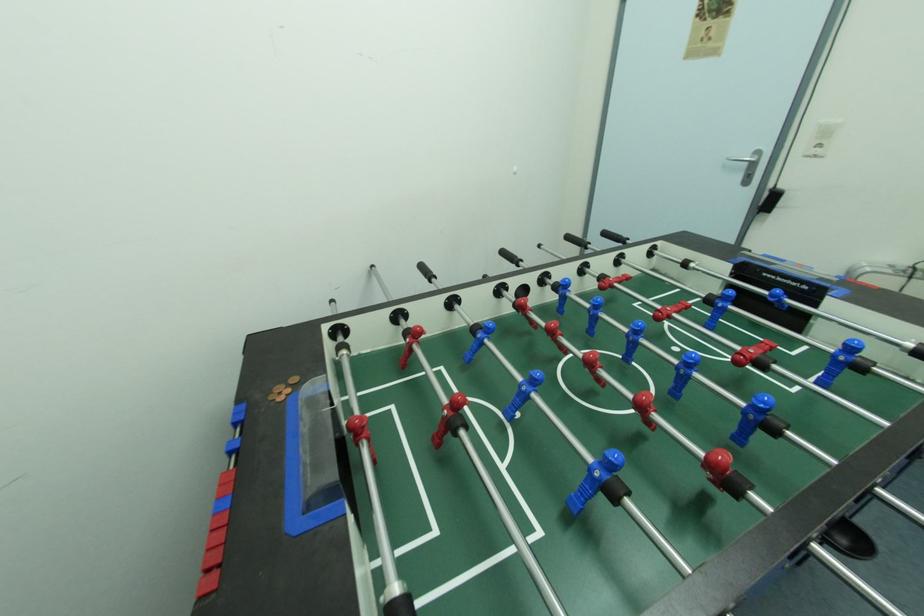
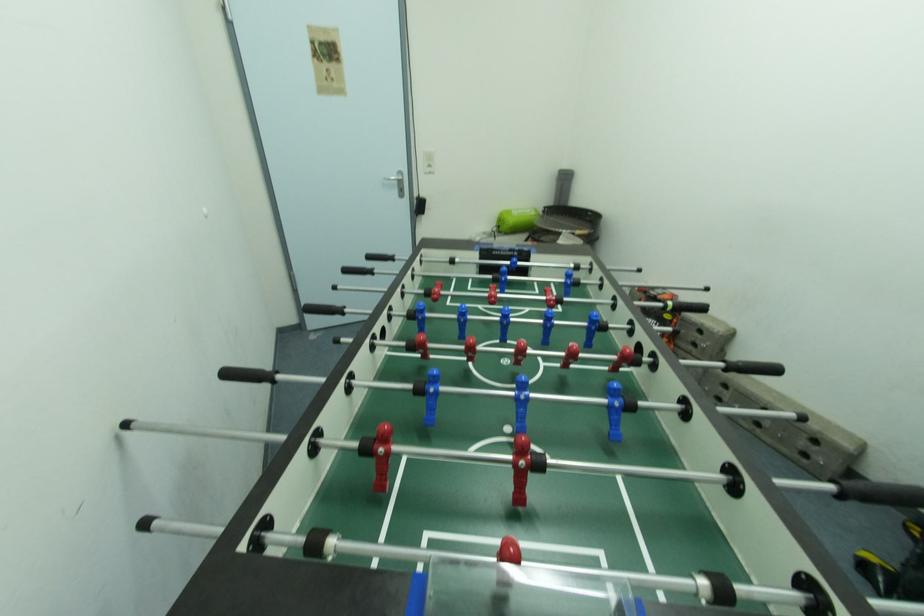
Question: The camera is either moving clockwise (left) or counter-clockwise (right) around the object. The first image is from the beginning of the video and the second image is from the end. Is the camera moving left or right when shooting the video?

Choices:
 (A) Left
 (B) Right

Answer: (A)